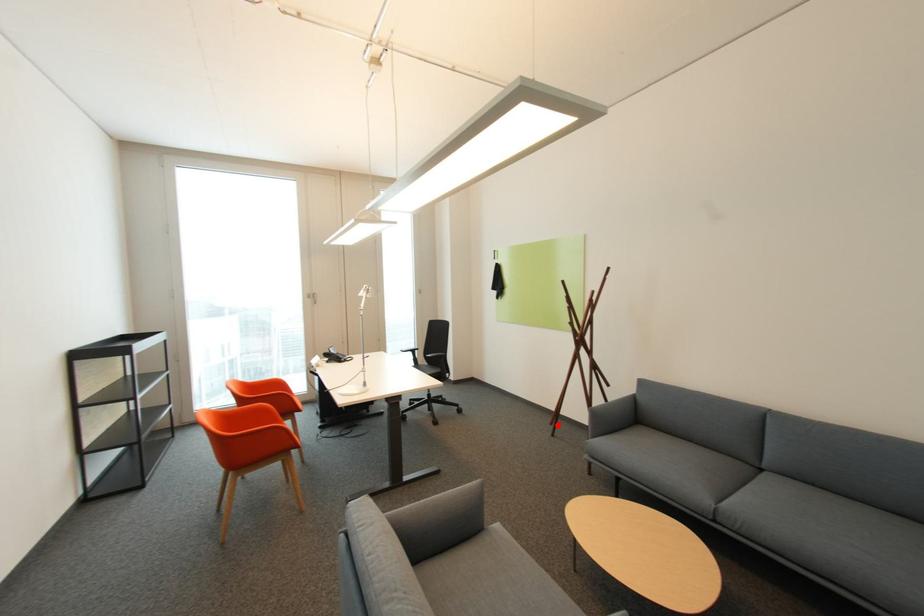
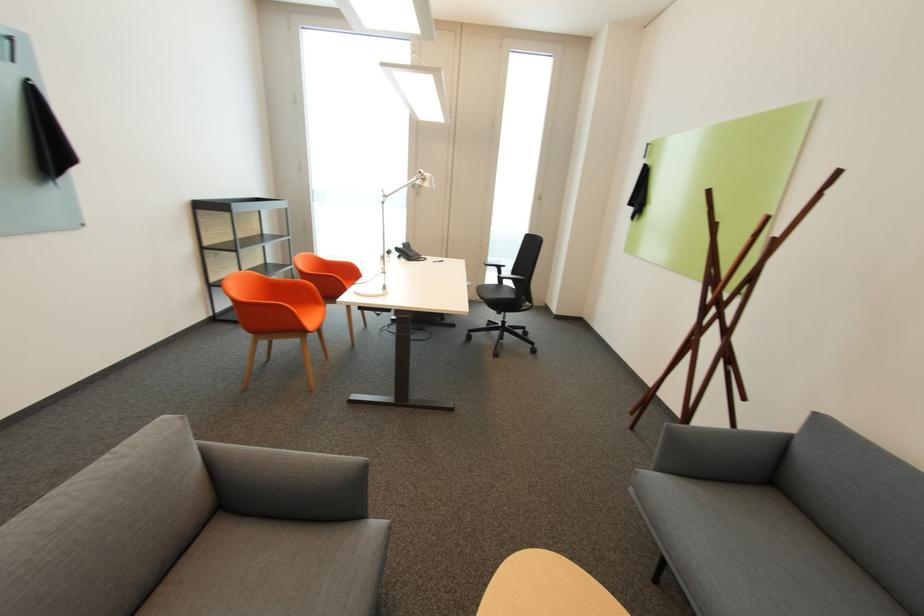
Question: I am providing you with two images of the same scene from different viewpoints. Given a red point in image1, look at the same physical point in image2. Is it:

Choices:
 (A) Closer to the viewpoint
 (B) Farther from the viewpoint

Answer: (A)